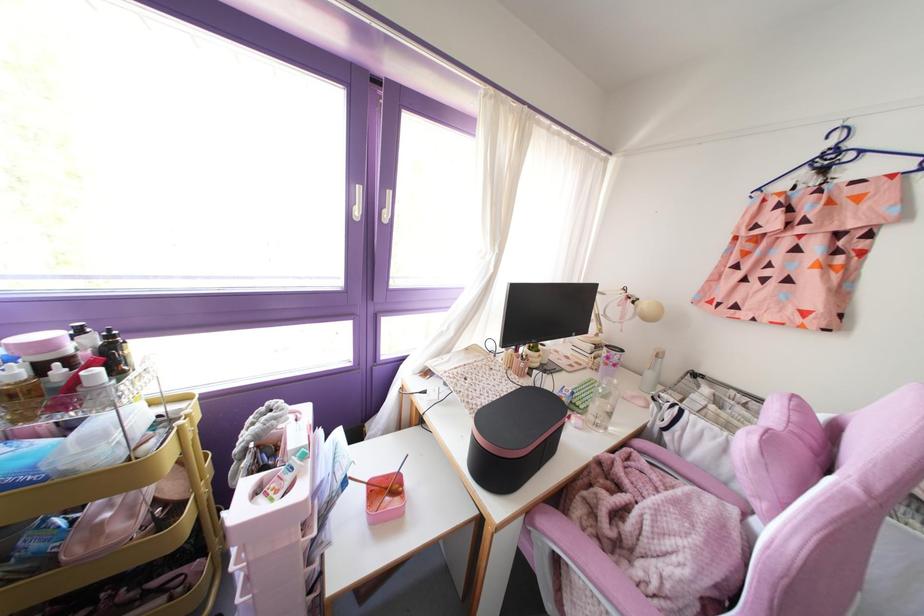
Locate an element on the screen. white desk lamp is located at coordinates (623, 309).